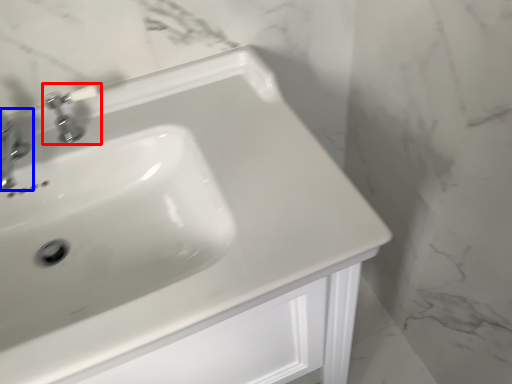
Question: Which object is closer to the camera taking this photo, tap (highlighted by a red box) or tap (highlighted by a blue box)?

Choices:
 (A) tap
 (B) tap

Answer: (B)